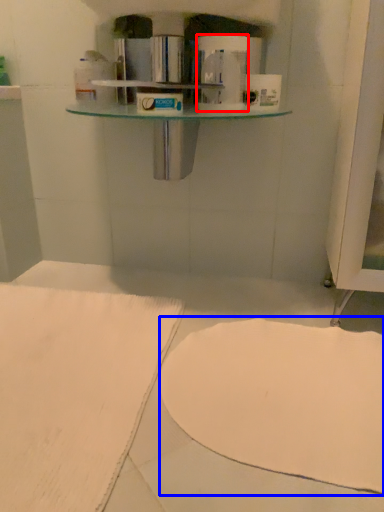
Question: Which object appears farthest to the camera in this image, toilet paper (highlighted by a red box) or wide (highlighted by a blue box)?

Choices:
 (A) toilet paper
 (B) wide

Answer: (A)